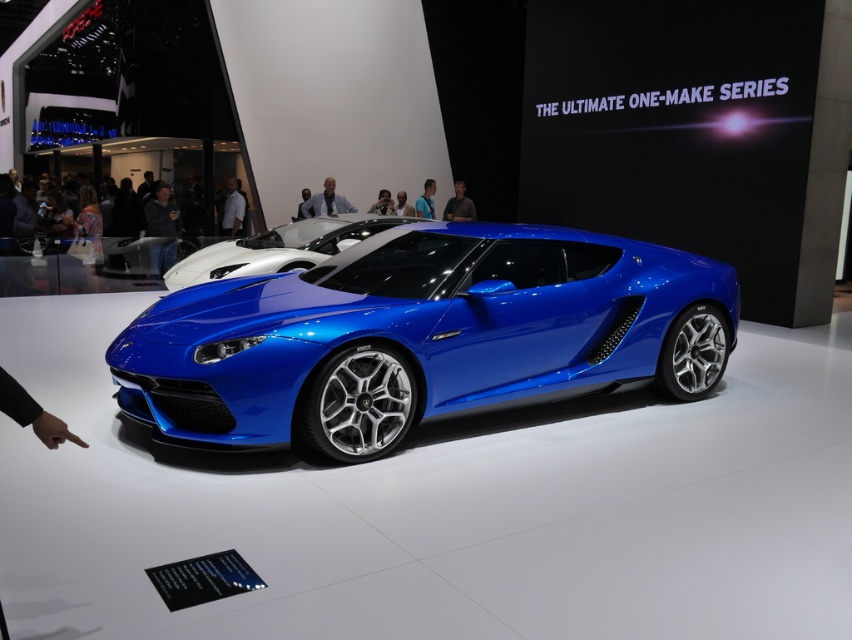
You are a photographer at an auto show and need to position your camera to capture both the shiny blue sports car at center and the shiny blue car at center in the same frame. However, you notice that one of them is significantly taller than the other. Which car should you adjust your camera angle to focus on to ensure both are fully visible?

The shiny blue sports car at center is much taller than the shiny blue car at center. To ensure both are fully visible, adjust the camera angle to focus on the shiny blue sports car at center since it is taller, allowing the shorter shiny blue car at center to still be captured in the frame.

You are attending an auto show and notice two shirts displayed on mannequins in front of the sports car. The shirts are labeled as the light blue shirt at center and the white smooth shirt at center. Which shirt is shorter?

The light blue shirt at center is shorter than the white smooth shirt at center.

You are at an auto show and want to locate the shiny blue sports car. According to the map provided, there is a point marked at coordinates (421, 336). Where should you look to find the shiny blue sports car?

The point marked at coordinates (421, 336) indicates the location of the shiny blue sports car at center, so you should look towards the center of the exhibition area.